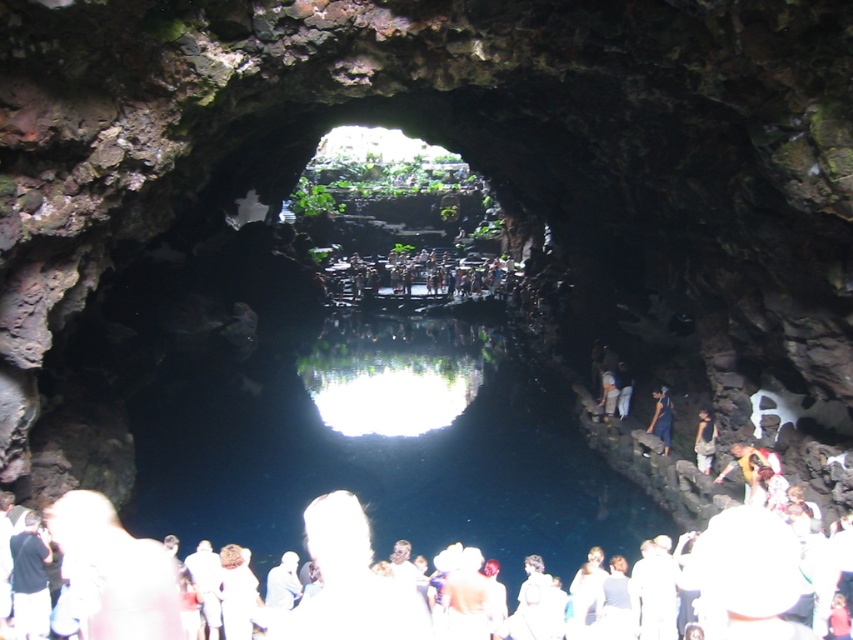
Question: Can you confirm if light brown fabric shirt at center is positioned below dark blue jeans at center?

Choices:
 (A) yes
 (B) no

Answer: (A)

Question: From the image, what is the correct spatial relationship of light brown fabric shirt at center in relation to dark blue jeans at center?

Choices:
 (A) above
 (B) below

Answer: (B)

Question: Which object appears closest to the camera in this image?

Choices:
 (A) light brown fabric shirt at center
 (B) dark blue jeans at center

Answer: (A)

Question: Where is light brown fabric shirt at center located in relation to dark blue jeans at center in the image?

Choices:
 (A) right
 (B) left

Answer: (A)